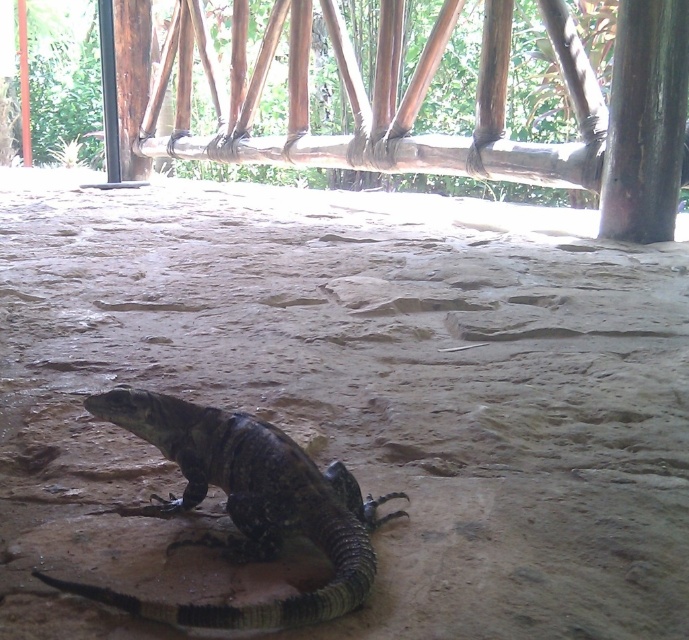
Question: Which of the following is the farthest from the observer?

Choices:
 (A) brown sandy ground at center
 (B) dark gray scaly lizard at center

Answer: (A)

Question: Can you confirm if brown sandy ground at center is wider than dark gray scaly lizard at center?

Choices:
 (A) no
 (B) yes

Answer: (B)

Question: Is brown sandy ground at center above dark gray scaly lizard at center?

Choices:
 (A) no
 (B) yes

Answer: (B)

Question: Is brown sandy ground at center thinner than dark gray scaly lizard at center?

Choices:
 (A) yes
 (B) no

Answer: (B)

Question: Which point is closer to the camera?

Choices:
 (A) dark gray scaly lizard at center
 (B) brown sandy ground at center

Answer: (A)

Question: Which of the following is the closest to the observer?

Choices:
 (A) (192, 625)
 (B) (391, 557)

Answer: (A)